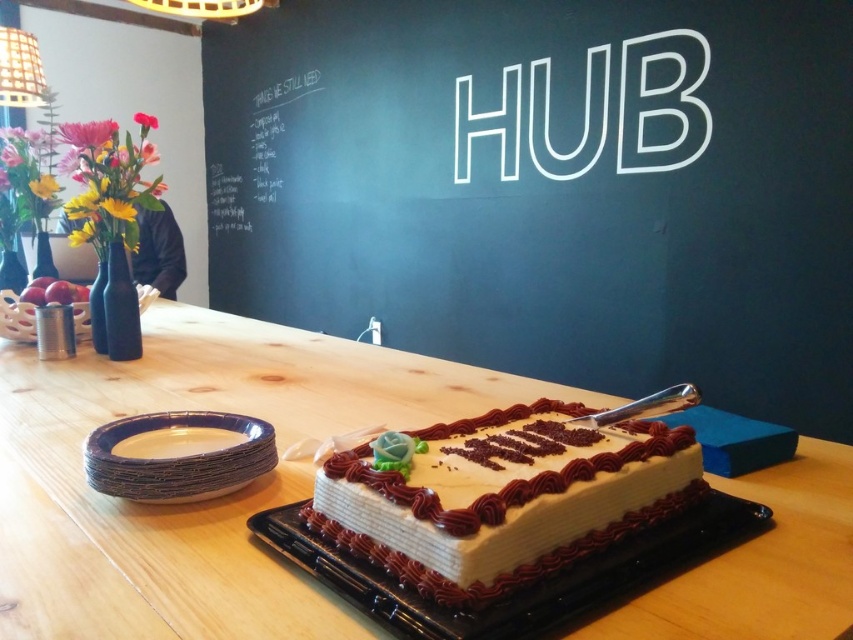
Can you confirm if wooden table at center is positioned to the left of white chalkboard at upper left?

Incorrect, wooden table at center is not on the left side of white chalkboard at upper left.

I want to click on wooden table at center, so click(199, 502).

This screenshot has height=640, width=853. I want to click on wooden table at center, so coord(199,502).

Who is lower down, white paper plates at lower left or white chalkboard at upper left?

white paper plates at lower left is lower down.

Between white paper plates at lower left and white chalkboard at upper left, which one appears on the left side from the viewer's perspective?

From the viewer's perspective, white chalkboard at upper left appears more on the left side.

Is point (202, 492) behind point (245, 173)?

No, it is in front of (245, 173).

At what (x,y) coordinates should I click in order to perform the action: click on white paper plates at lower left. Please return your answer as a coordinate pair (x, y). Looking at the image, I should click on (178, 456).

Is point (521, 541) closer to viewer compared to point (225, 214)?

That is True.

Is white frosted cake at center to the left of white chalkboard at upper left from the viewer's perspective?

Incorrect, white frosted cake at center is not on the left side of white chalkboard at upper left.

Who is more distant from viewer, (685,490) or (242,138)?

The point (242,138) is behind.

The height and width of the screenshot is (640, 853). I want to click on white frosted cake at center, so click(x=508, y=496).